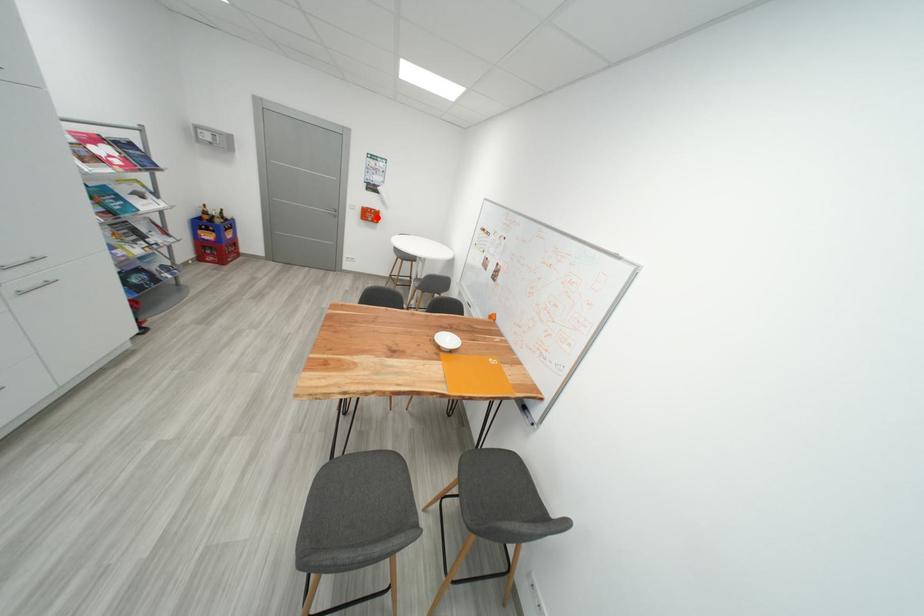
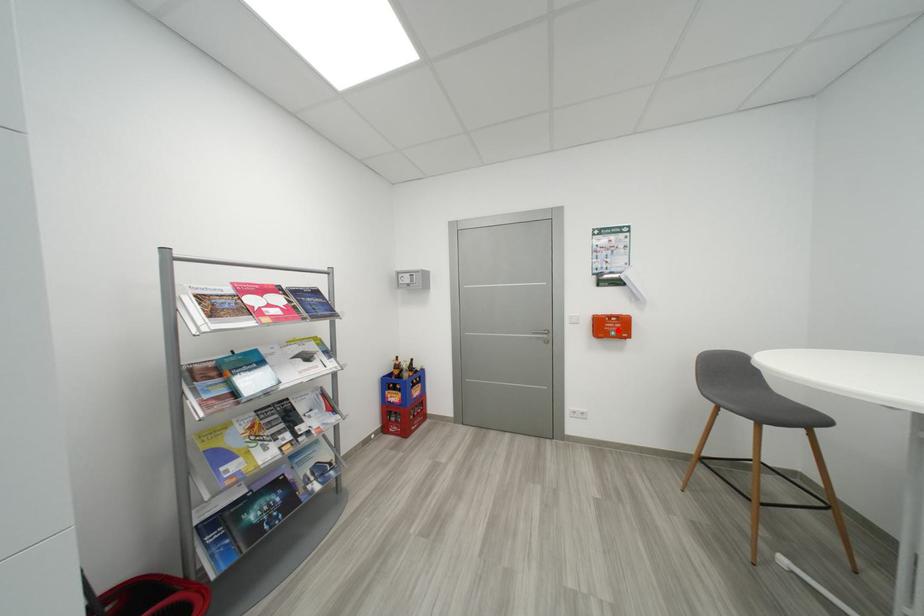
I am providing you with two images of the same scene from different viewpoints. A red point is marked on the first image and another point is marked on the second image. Do the highlighted points in image1 and image2 indicate the same real-world spot?

Yes